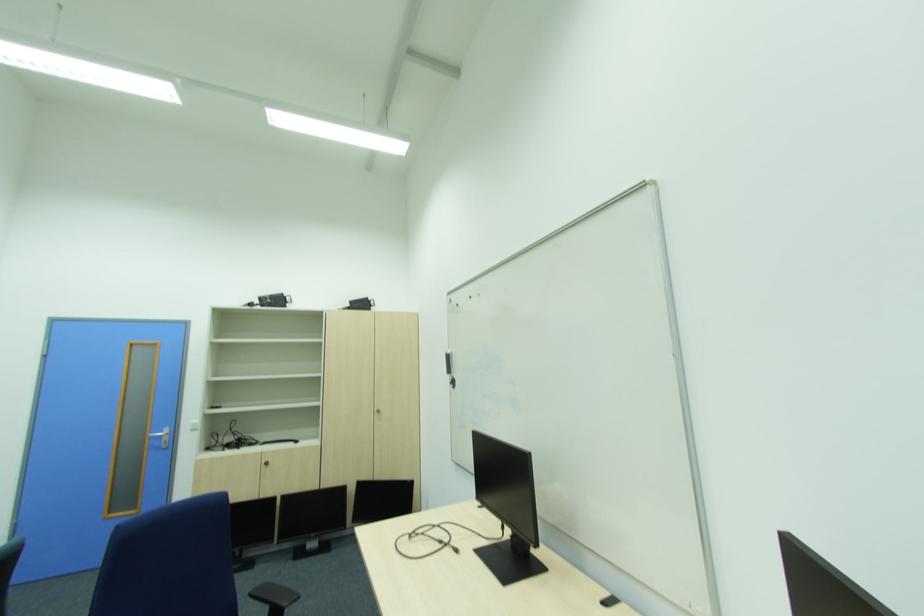
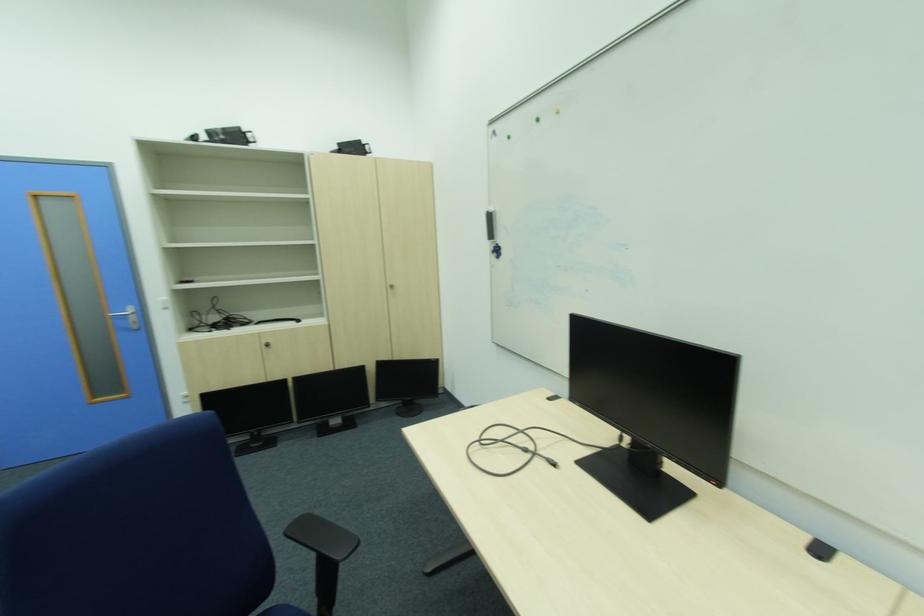
Question: Based on the continuous images, in which direction is the camera rotating? Reply with the corresponding letter.

Choices:
 (A) Left
 (B) Right
 (C) Up
 (D) Down

Answer: (D)